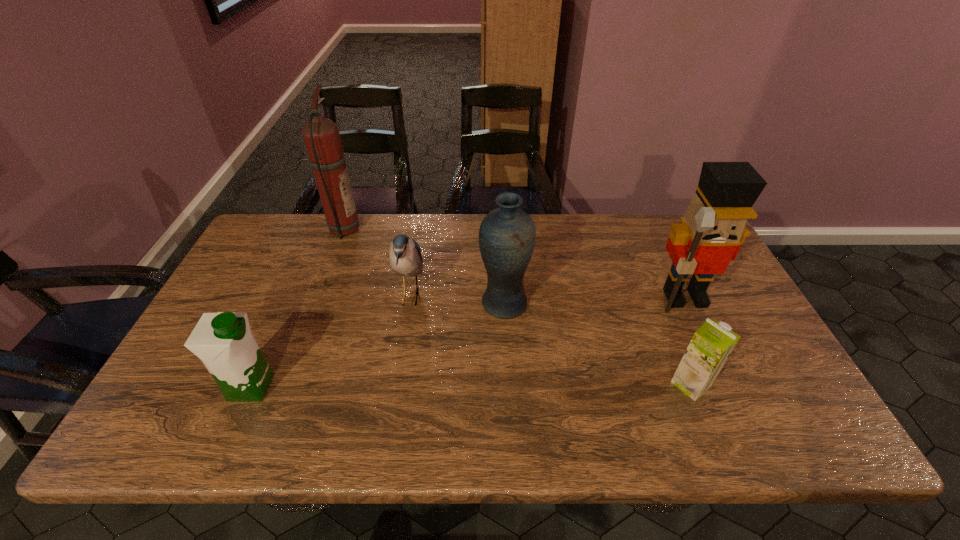
In the image, there is a desktop. Where is `vacant space at the far right corner`? The image size is (960, 540). vacant space at the far right corner is located at coordinates (647, 219).

At what (x,y) coordinates should I click in order to perform the action: click on vacant area between the vase and the nutcracker. Please return your answer as a coordinate pair (x, y). Looking at the image, I should click on (594, 301).

At what (x,y) coordinates should I click in order to perform the action: click on free spot between the left soya milk and the fire extinguisher. Please return your answer as a coordinate pair (x, y). The width and height of the screenshot is (960, 540). Looking at the image, I should click on (296, 308).

What are the coordinates of `vacant point located between the left soya milk and the right soya milk` in the screenshot? It's located at (470, 386).

Where is `free space between the right soya milk and the vase`? free space between the right soya milk and the vase is located at coordinates (597, 344).

Locate an element on the screen. The width and height of the screenshot is (960, 540). free point between the vase and the right soya milk is located at coordinates (597, 344).

Where is `empty space between the left soya milk and the right soya milk`? The width and height of the screenshot is (960, 540). empty space between the left soya milk and the right soya milk is located at coordinates (470, 386).

Identify the location of vacant space that is in between the right soya milk and the third object from right to left. coord(597,344).

This screenshot has height=540, width=960. I want to click on free spot between the right soya milk and the nutcracker, so click(x=688, y=341).

Where is `empty location between the left soya milk and the fire extinguisher`? The width and height of the screenshot is (960, 540). empty location between the left soya milk and the fire extinguisher is located at coordinates (296, 308).